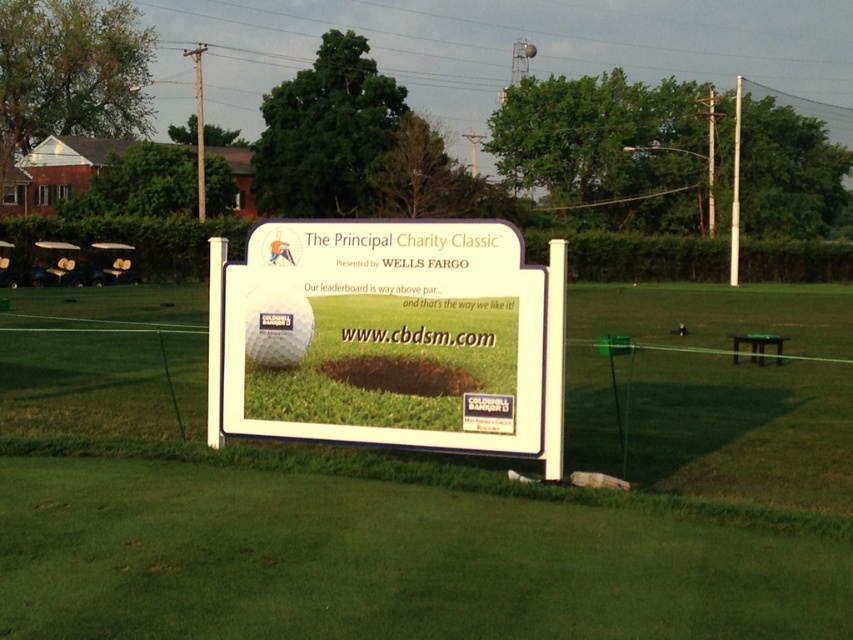
Question: Can you confirm if white matte sign at center is positioned to the right of white plastic sign at center?

Choices:
 (A) no
 (B) yes

Answer: (B)

Question: Which point is farther to the camera?

Choices:
 (A) (367, 234)
 (B) (798, 576)

Answer: (A)

Question: Does white matte sign at center have a larger size compared to white plastic sign at center?

Choices:
 (A) no
 (B) yes

Answer: (B)

Question: Does white matte sign at center have a smaller size compared to white plastic sign at center?

Choices:
 (A) yes
 (B) no

Answer: (B)

Question: Among these objects, which one is farthest from the camera?

Choices:
 (A) white plastic sign at center
 (B) white matte sign at center

Answer: (A)